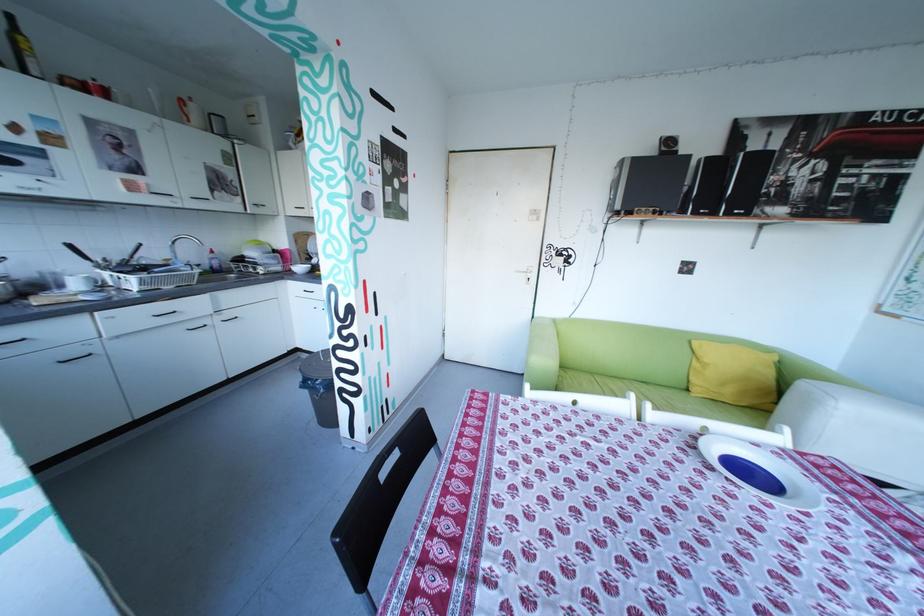
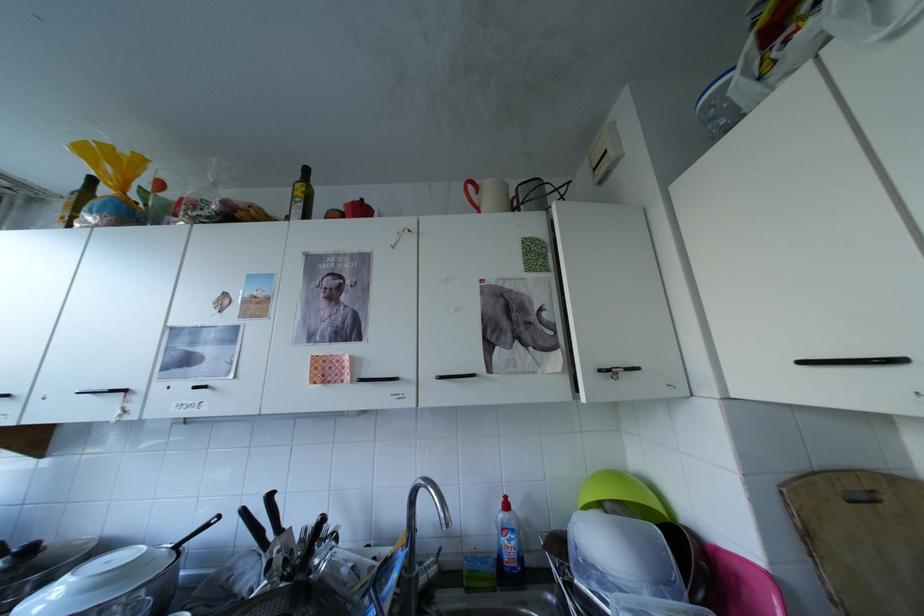
Find the pixel in the second image that matches [35,47] in the first image.

(309, 193)